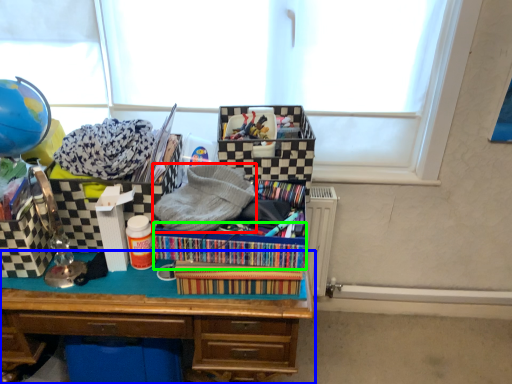
Question: Estimate the real-world distances between objects in this image. Which object is farther from clothing (highlighted by a red box), desk (highlighted by a blue box) or crate (highlighted by a green box)?

Choices:
 (A) desk
 (B) crate

Answer: (A)